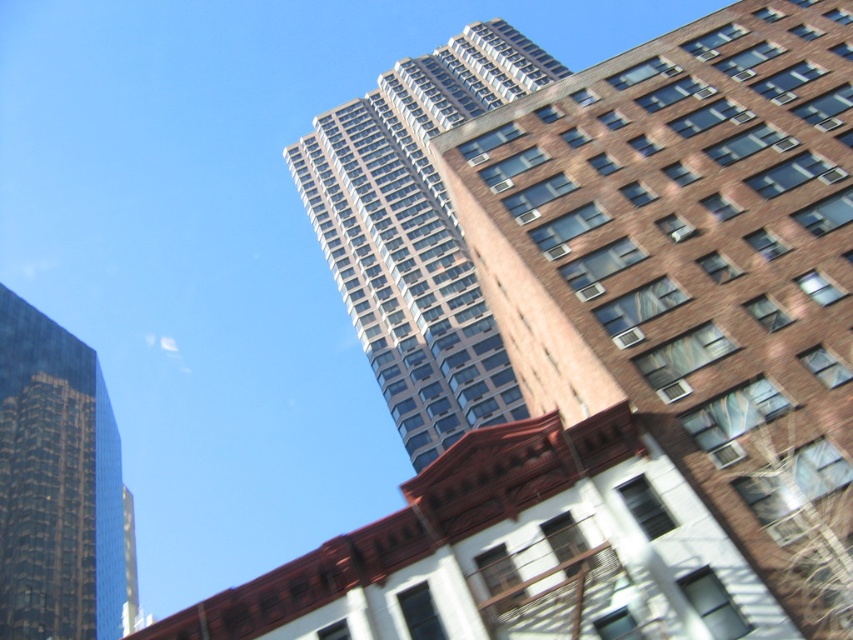
You are an architect analyzing the city layout. You need to determine which building takes up more visual space in the image between the brown brick building at upper center and the shiny glass skyscraper at left. Which one would you choose?

The shiny glass skyscraper at left occupies more visual space in the image than the brown brick building at upper center according to the description.

In the scene shown: You are an architect analyzing the cityscape. You need to determine which of the two skyscrapers, the glassy concrete skyscraper at center or the shiny glass skyscraper at left, has a greater horizontal span. Based on the scene, which one is wider?

Result: The glassy concrete skyscraper at center has a greater width than the shiny glass skyscraper at left, so it has a greater horizontal span.